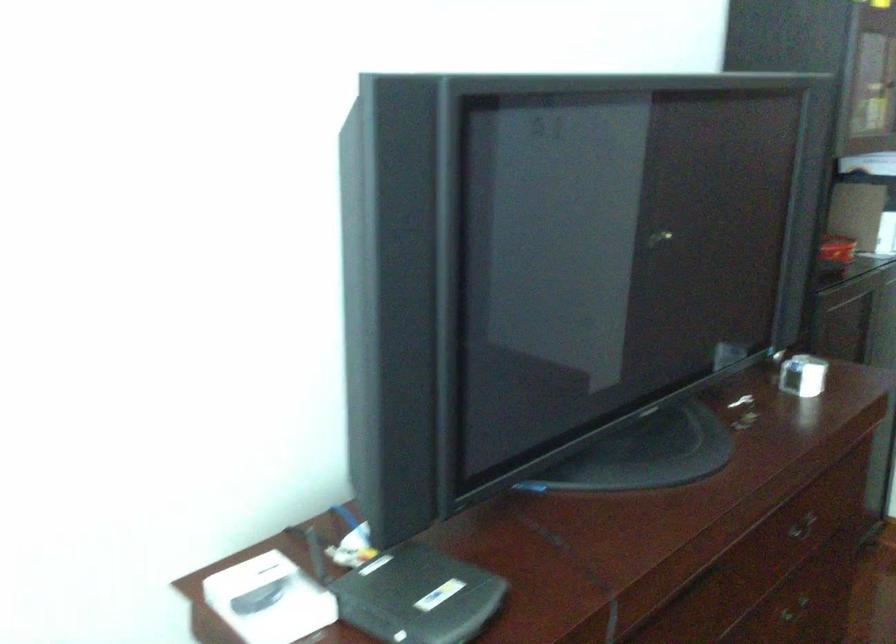
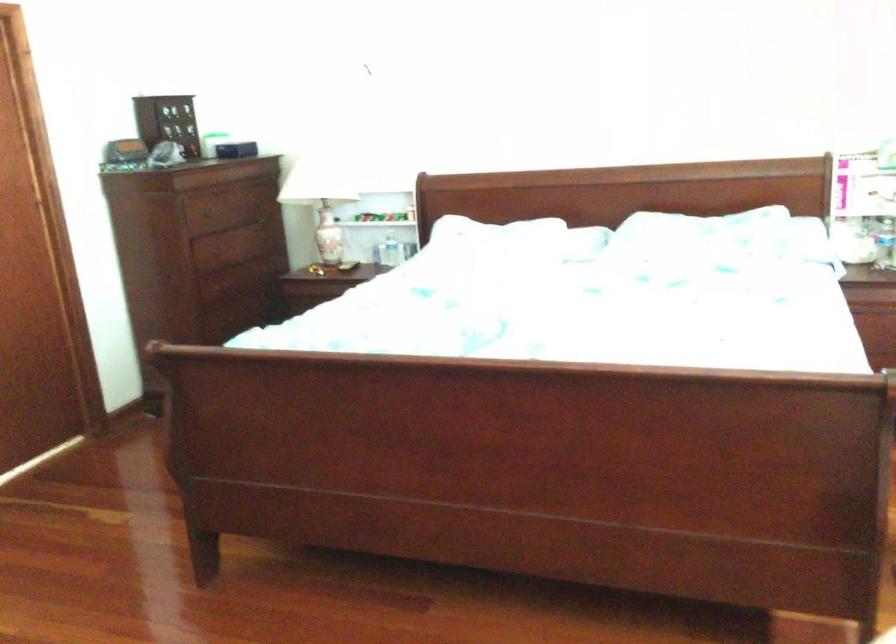
How did the camera likely rotate?

The camera rotated toward right-down.